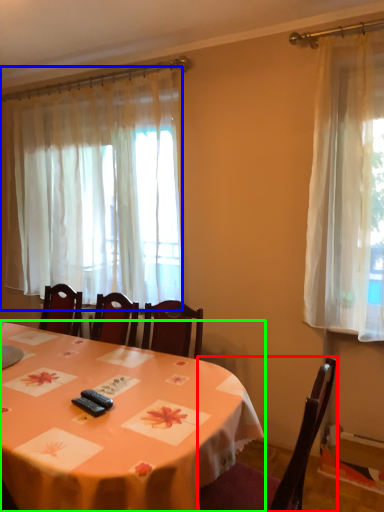
Question: Based on their relative distances, which object is farther from chair (highlighted by a red box)? Choose from curtain (highlighted by a blue box) and table (highlighted by a green box).

Choices:
 (A) curtain
 (B) table

Answer: (A)